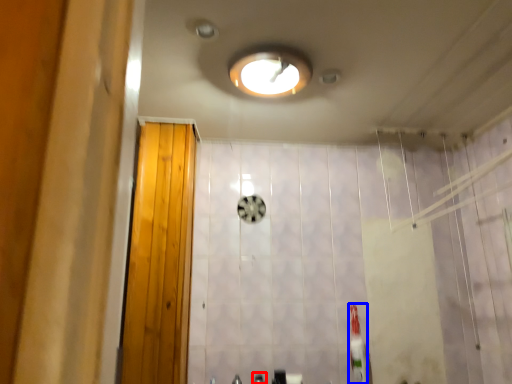
Question: Among these objects, which one is farthest to the camera, faucet (highlighted by a red box) or toothbrush (highlighted by a blue box)?

Choices:
 (A) faucet
 (B) toothbrush

Answer: (B)